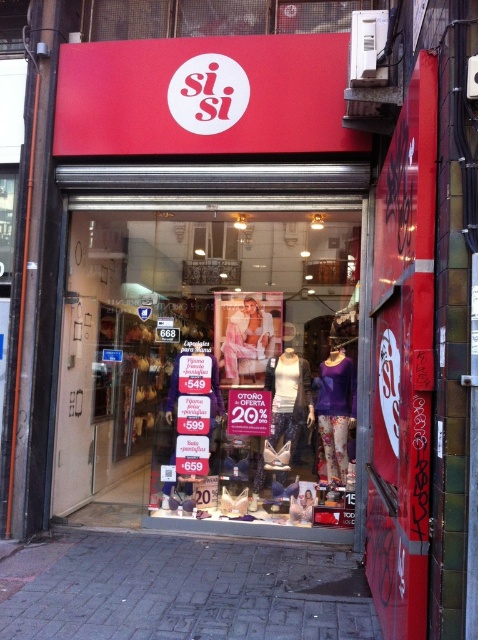
Between point (97, 488) and point (319, 476), which one is positioned behind?

Positioned behind is point (97, 488).

Find the location of a particular element. The width and height of the screenshot is (478, 640). transparent glass at center is located at coordinates (209, 356).

Find the location of a particular element. transparent glass at center is located at coordinates (209, 356).